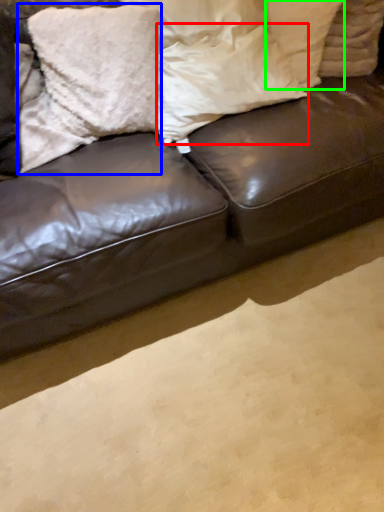
Question: Which is farther away from pillow (highlighted by a red box)? pillow (highlighted by a blue box) or pillow (highlighted by a green box)?

Choices:
 (A) pillow
 (B) pillow

Answer: (B)